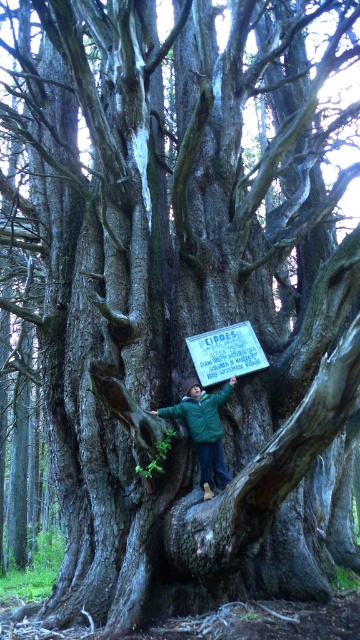
You are standing in front of the ancient tree and notice the green matte jacket at center and the wooden sign at center. Which object is positioned more to the left from your viewpoint?

The green matte jacket at center is to the left of the wooden sign at center, so the green matte jacket at center is positioned more to the left.

You are a photographer trying to capture the person and the sign clearly in a single shot. Given that the green matte jacket at center and the wooden sign at center are both in focus, which object will appear larger in the photo?

The green matte jacket at center will appear larger in the photo because it has a greater height compared to the wooden sign at center.